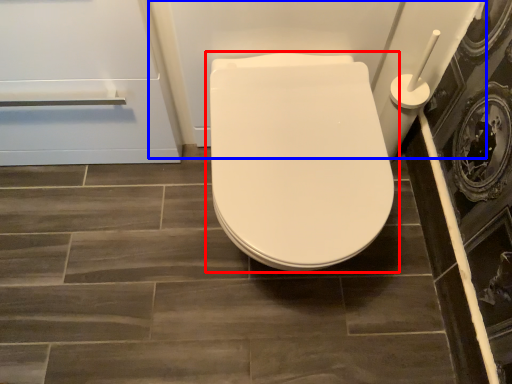
Question: Which object appears farthest to the camera in this image, toilet (highlighted by a red box) or bath (highlighted by a blue box)?

Choices:
 (A) toilet
 (B) bath

Answer: (B)